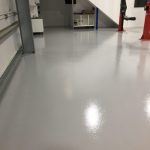
The height and width of the screenshot is (150, 150). In order to click on window in this screenshot , I will do point(139,2), point(76,17), point(84,19), point(91,19).